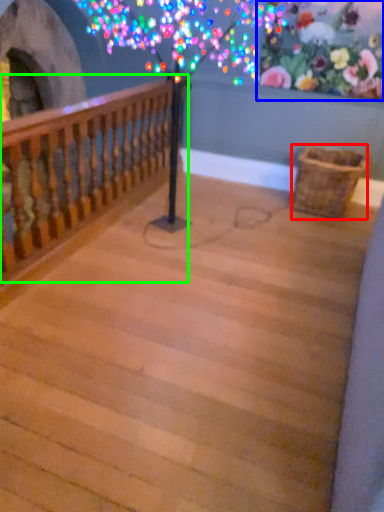
Question: Estimate the real-world distances between objects in this image. Which object is farther from basket (highlighted by a red box), floral arrangement (highlighted by a blue box) or rail (highlighted by a green box)?

Choices:
 (A) floral arrangement
 (B) rail

Answer: (B)